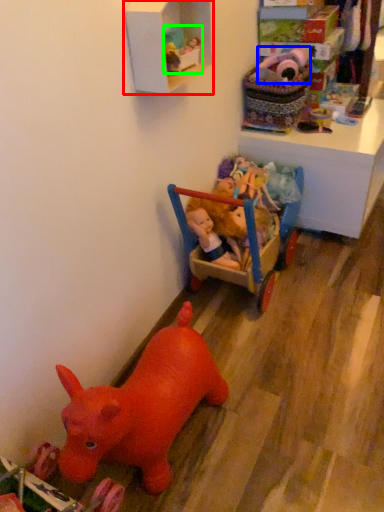
Question: Which object is the farthest from shelf (highlighted by a red box)? Choose among these: toy (highlighted by a blue box) or toy (highlighted by a green box).

Choices:
 (A) toy
 (B) toy

Answer: (A)